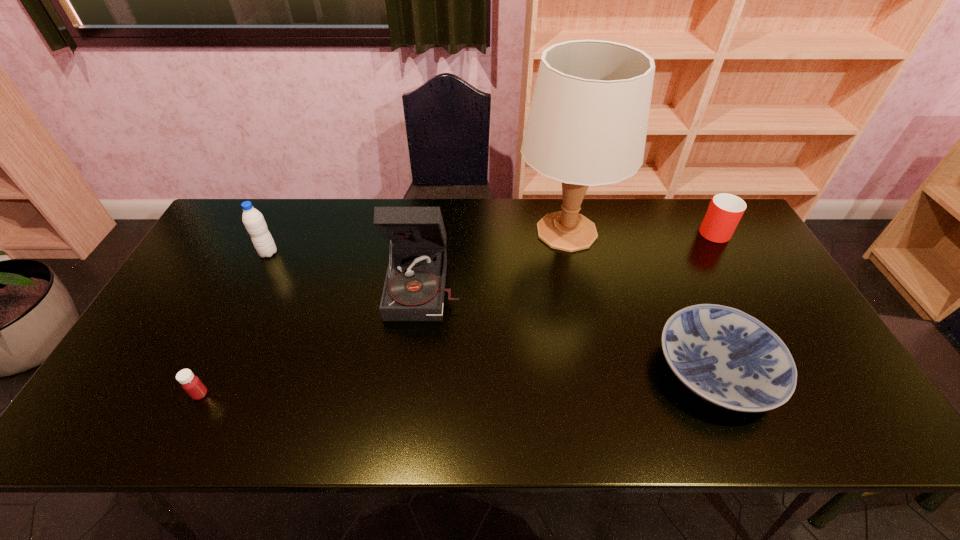
The height and width of the screenshot is (540, 960). What are the coordinates of `vacant space that is in between the third tallest object and the medicine` in the screenshot? It's located at (234, 323).

Where is `object that is the nearest to the fourth shortest object`? object that is the nearest to the fourth shortest object is located at coordinates (414, 288).

Locate an element on the screen. Image resolution: width=960 pixels, height=540 pixels. object that can be found as the third closest to the tallest object is located at coordinates (724, 212).

Where is `free space that satisfies the following two spatial constraints: 1. on the front-facing side of the plate; 2. on the left side of the phonograph_record`? This screenshot has width=960, height=540. free space that satisfies the following two spatial constraints: 1. on the front-facing side of the plate; 2. on the left side of the phonograph_record is located at coordinates (415, 370).